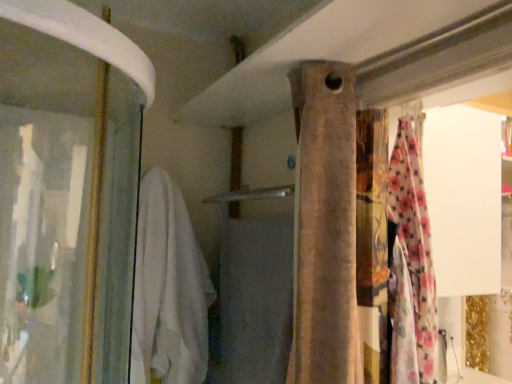
Question: Does beige fabric curtain at center lie in front of white soft towel at left?

Choices:
 (A) no
 (B) yes

Answer: (B)

Question: Is beige fabric curtain at center outside white soft towel at left?

Choices:
 (A) no
 (B) yes

Answer: (B)

Question: From the image's perspective, does beige fabric curtain at center appear lower than white soft towel at left?

Choices:
 (A) no
 (B) yes

Answer: (A)

Question: Considering the relative sizes of beige fabric curtain at center and white soft towel at left in the image provided, is beige fabric curtain at center thinner than white soft towel at left?

Choices:
 (A) yes
 (B) no

Answer: (A)

Question: Considering the relative sizes of beige fabric curtain at center and white soft towel at left in the image provided, is beige fabric curtain at center shorter than white soft towel at left?

Choices:
 (A) yes
 (B) no

Answer: (A)

Question: Is white soft towel at left taller or shorter than white soft towel at center?

Choices:
 (A) short
 (B) tall

Answer: (B)

Question: Is white soft towel at left inside the boundaries of white soft towel at center, or outside?

Choices:
 (A) outside
 (B) inside

Answer: (A)

Question: From a real-world perspective, relative to white soft towel at center, is white soft towel at left vertically above or below?

Choices:
 (A) above
 (B) below

Answer: (A)

Question: Considering their positions, is white soft towel at left located in front of or behind white soft towel at center?

Choices:
 (A) behind
 (B) front

Answer: (A)

Question: Considering the positions of white soft towel at center and beige fabric curtain at center in the image, is white soft towel at center taller or shorter than beige fabric curtain at center?

Choices:
 (A) short
 (B) tall

Answer: (A)

Question: Looking at their shapes, would you say white soft towel at center is wider or thinner than beige fabric curtain at center?

Choices:
 (A) wide
 (B) thin

Answer: (B)

Question: Considering the positions of white soft towel at center and beige fabric curtain at center in the image, is white soft towel at center bigger or smaller than beige fabric curtain at center?

Choices:
 (A) small
 (B) big

Answer: (B)

Question: Relative to beige fabric curtain at center, is white soft towel at center in front or behind?

Choices:
 (A) behind
 (B) front

Answer: (A)

Question: Looking at their shapes, would you say white soft towel at left is wider or thinner than beige fabric curtain at center?

Choices:
 (A) wide
 (B) thin

Answer: (A)

Question: In the image, is white soft towel at left on the left side or the right side of beige fabric curtain at center?

Choices:
 (A) right
 (B) left

Answer: (B)